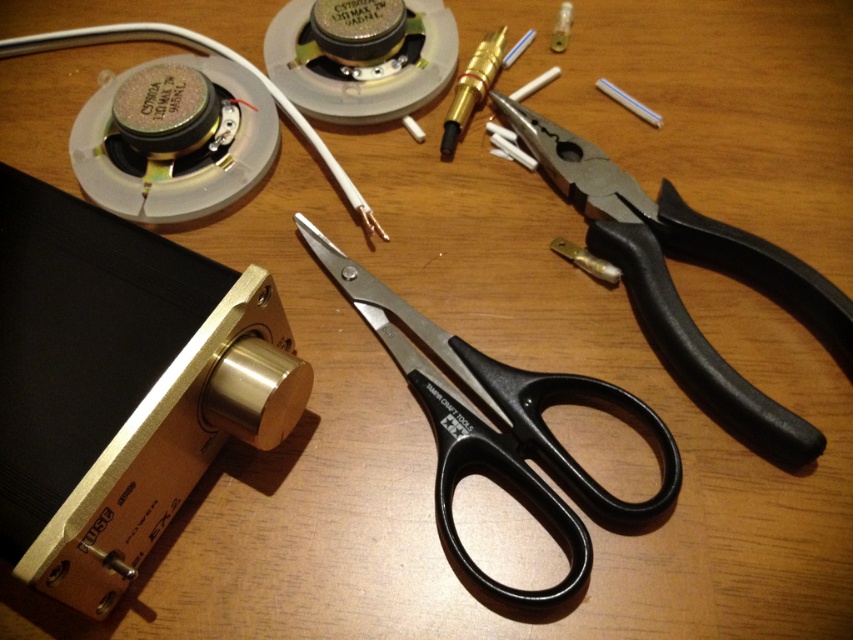
Question: Which point is closer to the camera?

Choices:
 (A) gold-plated connector at upper center
 (B) black plastic pliers at upper right

Answer: (B)

Question: Can you confirm if gold metallic knob at center is wider than black plastic pliers at upper right?

Choices:
 (A) no
 (B) yes

Answer: (A)

Question: Where is gold metallic knob at center located in relation to white matte wire at upper left in the image?

Choices:
 (A) below
 (B) above

Answer: (A)

Question: Which point is closer to the camera?

Choices:
 (A) black plastic scissors at center
 (B) white matte wire at upper left
 (C) gold-plated connector at upper center

Answer: (A)

Question: Which object is closer to the camera taking this photo?

Choices:
 (A) gold-plated connector at upper center
 (B) black plastic scissors at center
 (C) gold metallic knob at center
 (D) white matte wire at upper left

Answer: (C)

Question: From the image, what is the correct spatial relationship of black plastic pliers at upper right in relation to gold-plated connector at upper center?

Choices:
 (A) left
 (B) right

Answer: (B)